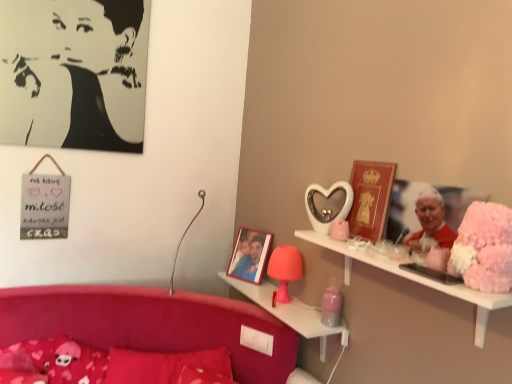
The width and height of the screenshot is (512, 384). What are the coordinates of `free space in front of matte pink plastic table lamp at center, which appears as the 2th table lamp when viewed from the left` in the screenshot? It's located at (295, 313).